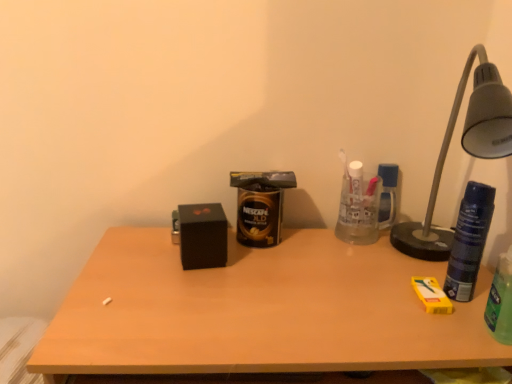
Find the location of a particular element. space that is in front of gold metallic can at center, arranged as the third beverage when viewed from the front is located at coordinates (266, 281).